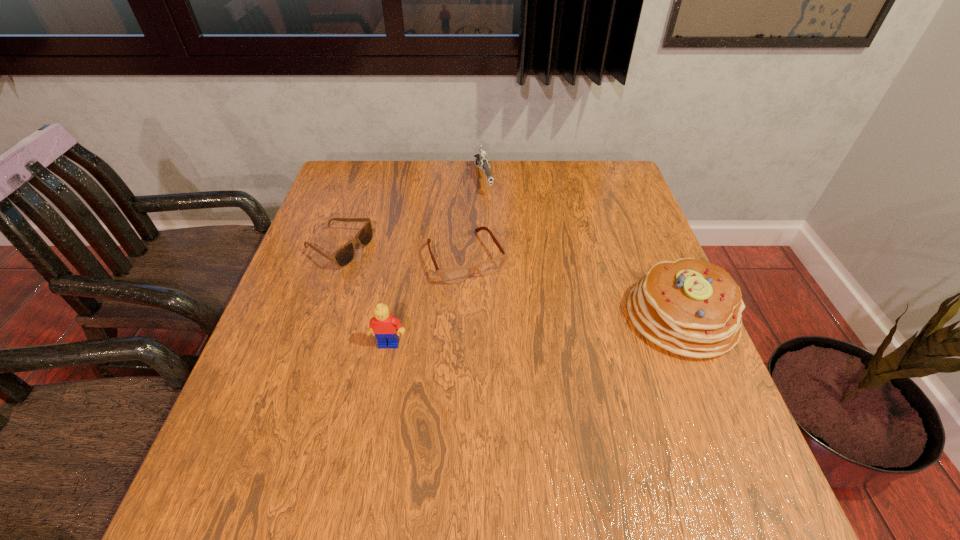
Locate an element on the screen. vacant area that lies between the pancake and the spectacles is located at coordinates (574, 287).

At what (x,y) coordinates should I click in order to perform the action: click on free space between the gun and the spectacles. Please return your answer as a coordinate pair (x, y). This screenshot has width=960, height=540. Looking at the image, I should click on (474, 218).

Locate an element on the screen. This screenshot has height=540, width=960. free space between the second object from left to right and the leftmost object is located at coordinates (364, 296).

The image size is (960, 540). In order to click on vacant point located between the spectacles and the Lego in this screenshot , I will do `click(427, 300)`.

This screenshot has width=960, height=540. Find the location of `object identified as the third closest to the sunglasses`. object identified as the third closest to the sunglasses is located at coordinates (481, 160).

This screenshot has width=960, height=540. Identify the location of object that stands as the closest to the spectacles. (343, 256).

Identify the location of blank area in the image that satisfies the following two spatial constraints: 1. on the back side of the third tallest object; 2. on the right side of the leftmost object. This screenshot has width=960, height=540. coord(362,179).